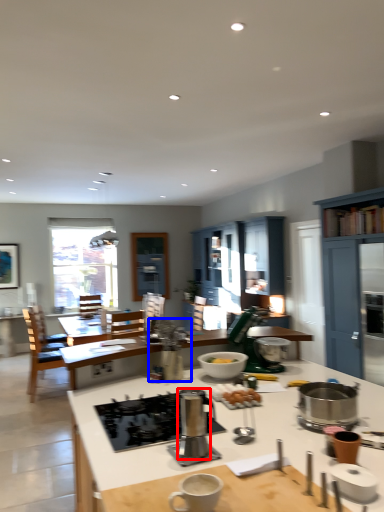
Question: Which of the following is the farthest to the observer, appliance (highlighted by a red box) or appliance (highlighted by a blue box)?

Choices:
 (A) appliance
 (B) appliance

Answer: (B)